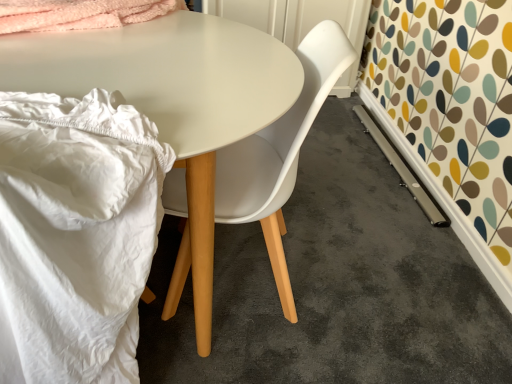
This screenshot has height=384, width=512. Identify the location of blank space above white glossy table at center (from a real-world perspective). 142,79.